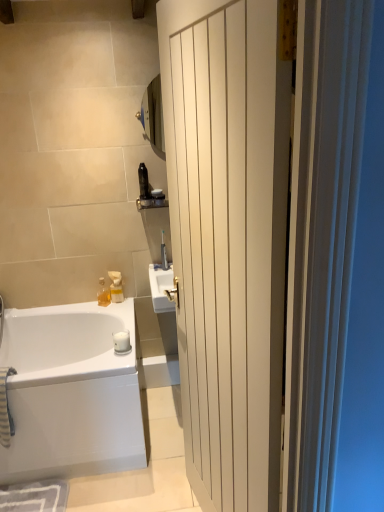
Find the location of a particular element. This screenshot has width=384, height=512. vacant space situated on the left part of translucent glass bottle at lower left, which ranks as the 4th toiletry in right-to-left order is located at coordinates (85, 306).